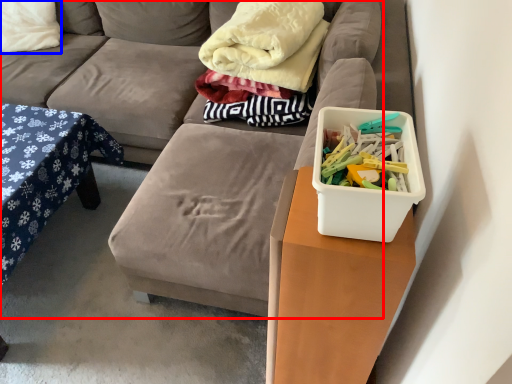
Question: Which object appears closest to the camera in this image, studio couch (highlighted by a red box) or pillow (highlighted by a blue box)?

Choices:
 (A) studio couch
 (B) pillow

Answer: (A)